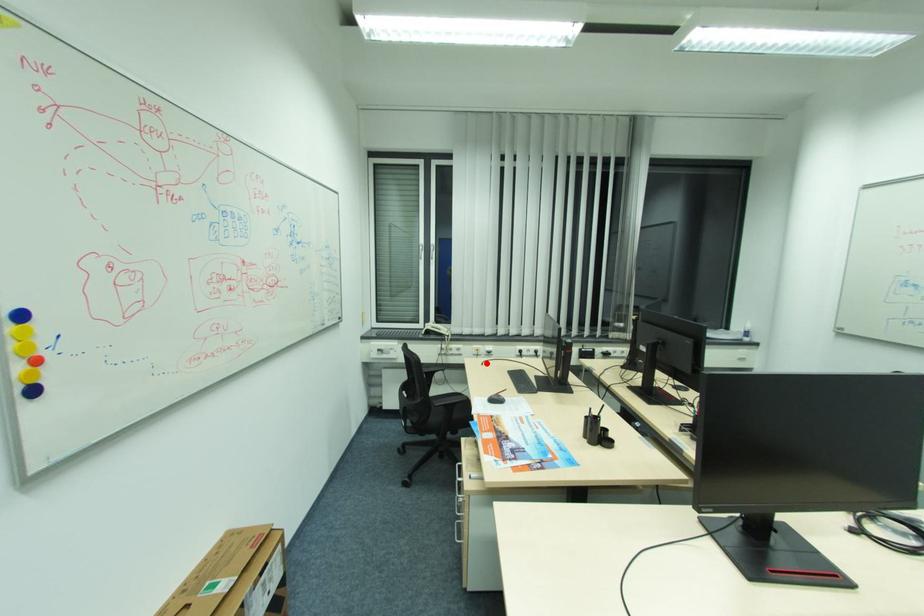
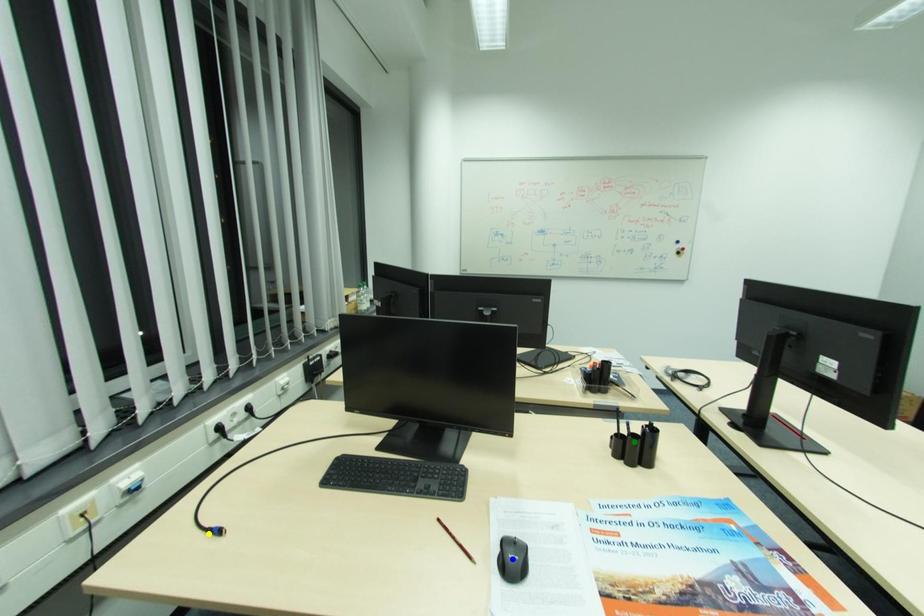
Question: I am providing you with two images of the same scene from different viewpoints. A red point is marked on the first image. You are given multiple points on the second image. Can you choose the point in image 2 that corresponds to the point in image 1?

Choices:
 (A) blue point
 (B) green point
 (C) yellow point

Answer: (C)